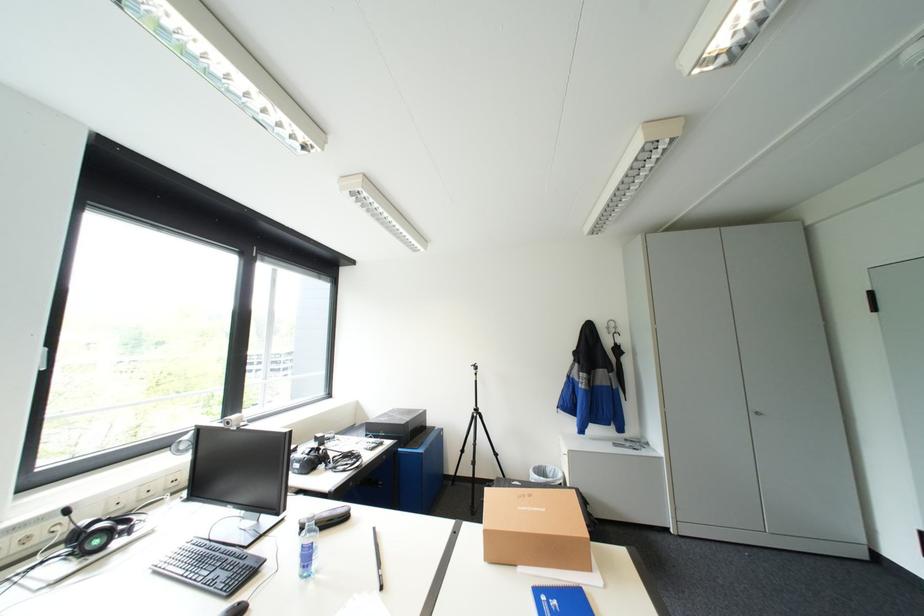
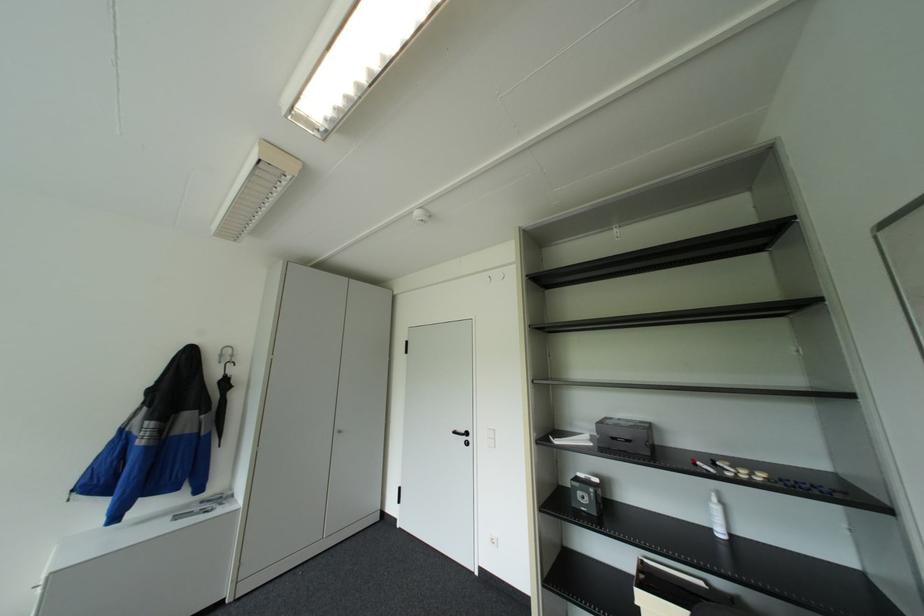
Where in the second image is the point corresponding to point 626,387 from the first image?

(217, 432)